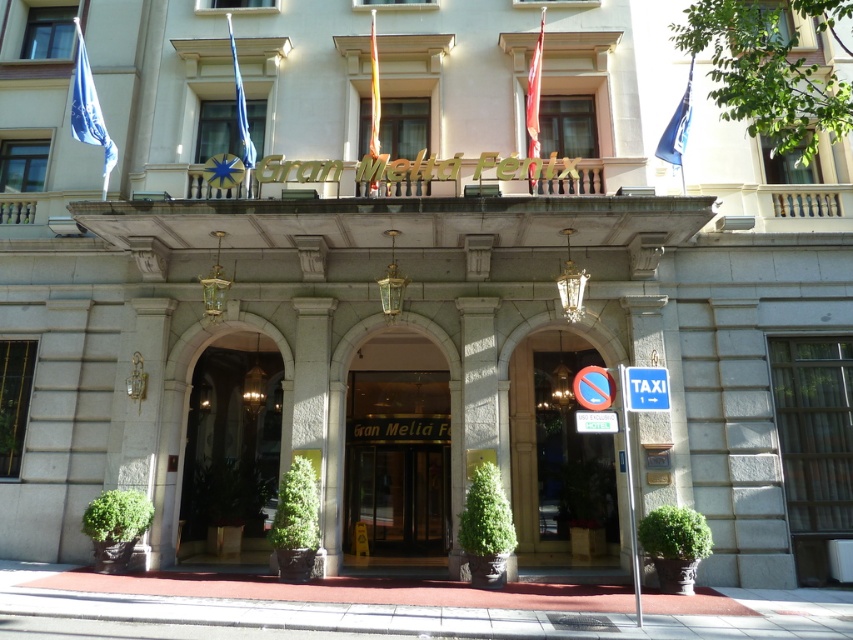
How distant is green glass door at center from blue fabric flag at upper center?

green glass door at center is 7.38 meters from blue fabric flag at upper center.

Between green glass door at center and blue fabric flag at upper center, which one is positioned lower?

green glass door at center

What do you see at coordinates (556, 456) in the screenshot? The image size is (853, 640). I see `green glass door at center` at bounding box center [556, 456].

Locate an element on the screen. The image size is (853, 640). green glass door at center is located at coordinates (556, 456).

Based on the photo, is smooth stone pillar at center shorter than blue fabric flag at upper left?

Indeed, smooth stone pillar at center has a lesser height compared to blue fabric flag at upper left.

What do you see at coordinates (479, 380) in the screenshot?
I see `smooth stone pillar at center` at bounding box center [479, 380].

This screenshot has height=640, width=853. In order to click on smooth stone pillar at center in this screenshot , I will do `click(479, 380)`.

Does green glass door at center have a greater height compared to metallic circular sign at right?

Yes.

How distant is green glass door at center from metallic circular sign at right?

green glass door at center and metallic circular sign at right are 5.03 meters apart.

Who is more distant from viewer, (566,406) or (602,376)?

The point (566,406) is more distant.

Locate an element on the screen. Image resolution: width=853 pixels, height=640 pixels. green glass door at center is located at coordinates 556,456.